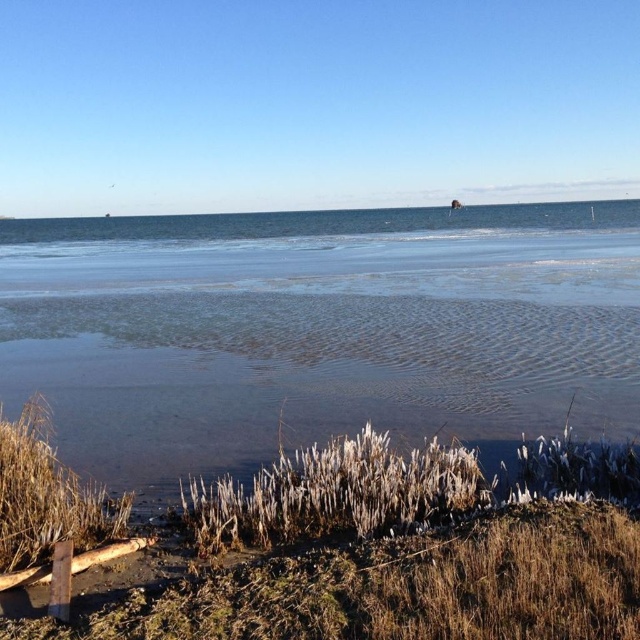
Does clear water at lower center lie behind brown grass at lower center?

That is True.

Is clear water at lower center bigger than brown grass at lower center?

Yes, clear water at lower center is bigger than brown grass at lower center.

Does point (611, 257) come closer to viewer compared to point (346, 468)?

No, (611, 257) is further to viewer.

You are a GUI agent. You are given a task and a screenshot of the screen. Output one action in this format:
    pyautogui.click(x=<x>, y=<y>)
    Task: Click on the clear water at lower center
    
    Given the screenshot: What is the action you would take?
    point(317,330)